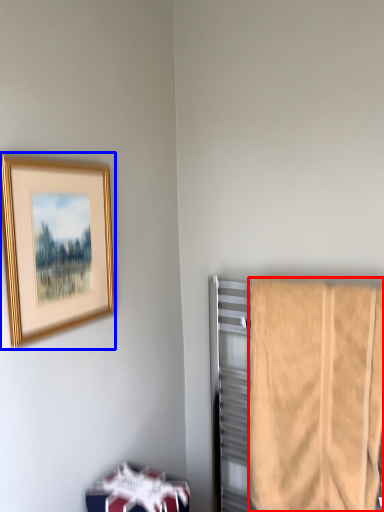
Question: Which object is further to the camera taking this photo, towel (highlighted by a red box) or picture frame (highlighted by a blue box)?

Choices:
 (A) towel
 (B) picture frame

Answer: (A)